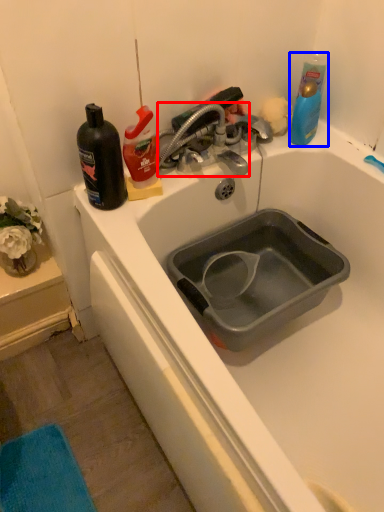
Question: Which point is further to the camera, tap (highlighted by a red box) or cleaning product (highlighted by a blue box)?

Choices:
 (A) tap
 (B) cleaning product

Answer: (B)